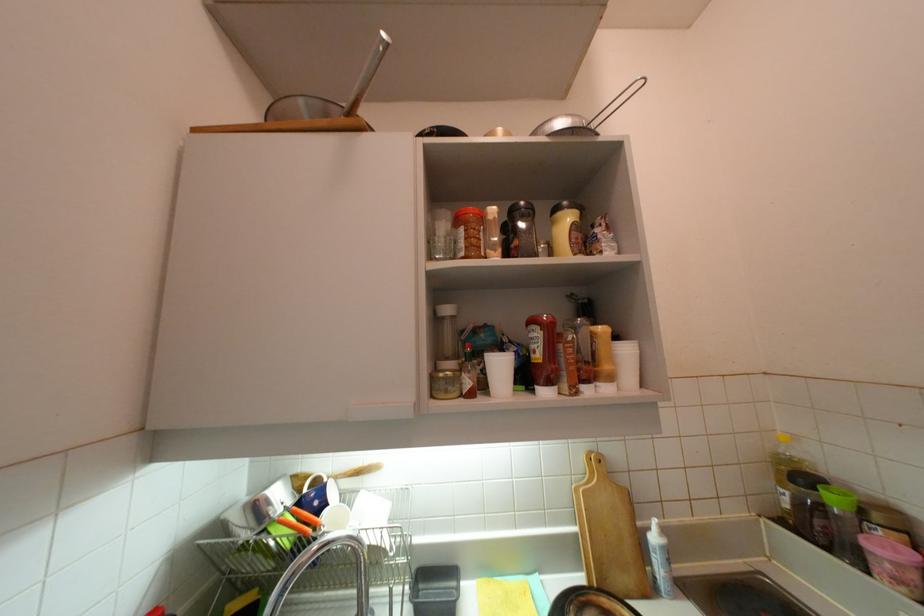
Locate an element on the screen. black spice grinder is located at coordinates (521, 230).